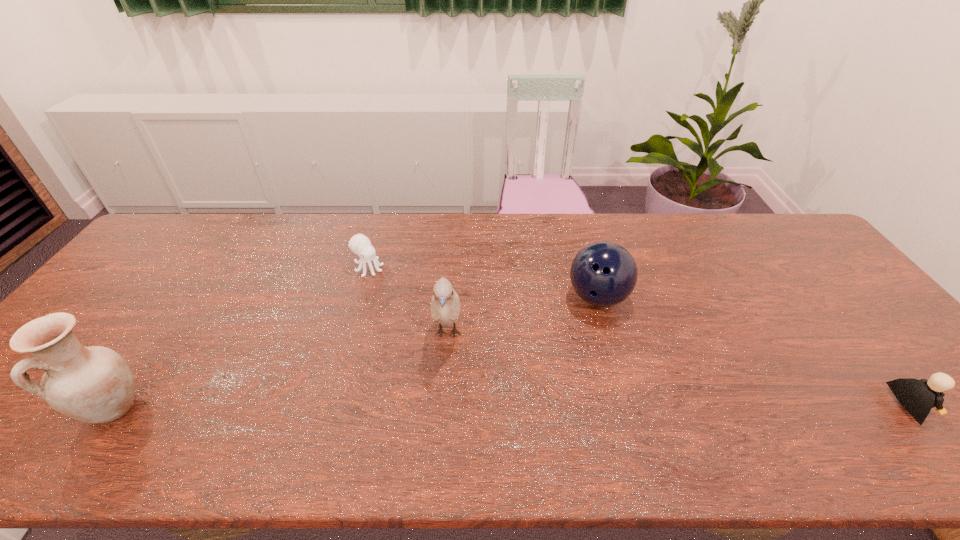
You are a GUI agent. You are given a task and a screenshot of the screen. Output one action in this format:
    pyautogui.click(x=<x>, y=<y>)
    Task: Click on the vacant space at the near edge of the desktop
    
    Given the screenshot: What is the action you would take?
    pyautogui.click(x=852, y=395)

At what (x,y) coordinates should I click in order to perform the action: click on blank space at the right edge of the desktop. Please return your answer as a coordinate pair (x, y). This screenshot has height=540, width=960. Looking at the image, I should click on (833, 331).

What are the coordinates of `vacant space at the far left corner` in the screenshot? It's located at (176, 242).

Where is `empty space between the third tallest object and the octopus`? empty space between the third tallest object and the octopus is located at coordinates (483, 282).

Identify the location of unoccupied area between the bird and the octopus. (408, 301).

Where is `free space between the pottery and the third shortest object`? The image size is (960, 540). free space between the pottery and the third shortest object is located at coordinates (355, 352).

Find the location of `vacant area that lies between the bird and the leftmost object`. vacant area that lies between the bird and the leftmost object is located at coordinates (280, 370).

Find the location of a particular element. The image size is (960, 540). free space between the octopus and the bowling ball is located at coordinates (483, 282).

You are a GUI agent. You are given a task and a screenshot of the screen. Output one action in this format:
    pyautogui.click(x=<x>, y=<y>)
    Task: Click on the vacant space that's between the rightmost object and the third object from left to right
    Image resolution: width=960 pixels, height=540 pixels.
    Given the screenshot: What is the action you would take?
    pyautogui.click(x=680, y=369)

Where is `vacant area that lies between the second object from right to left and the octopus`? This screenshot has height=540, width=960. vacant area that lies between the second object from right to left and the octopus is located at coordinates (483, 282).